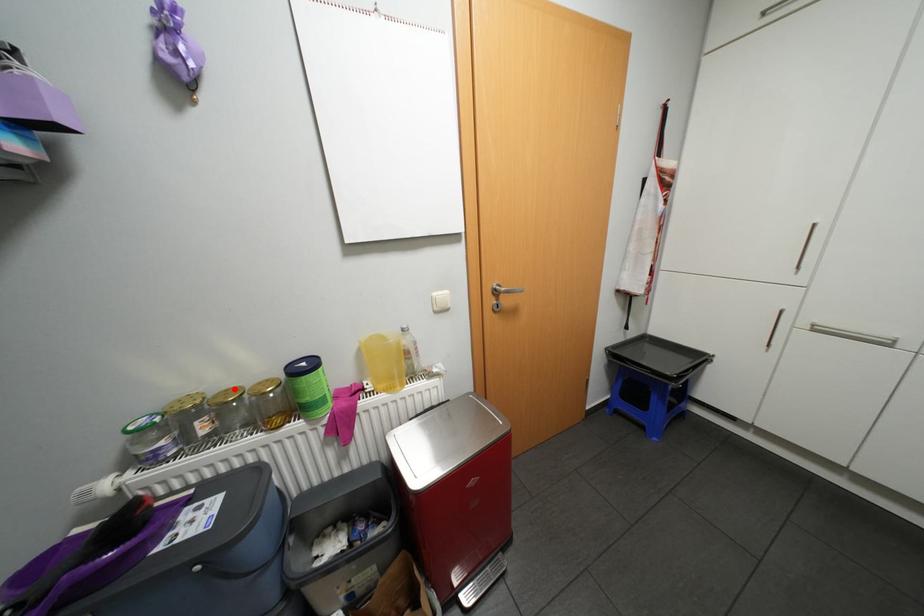
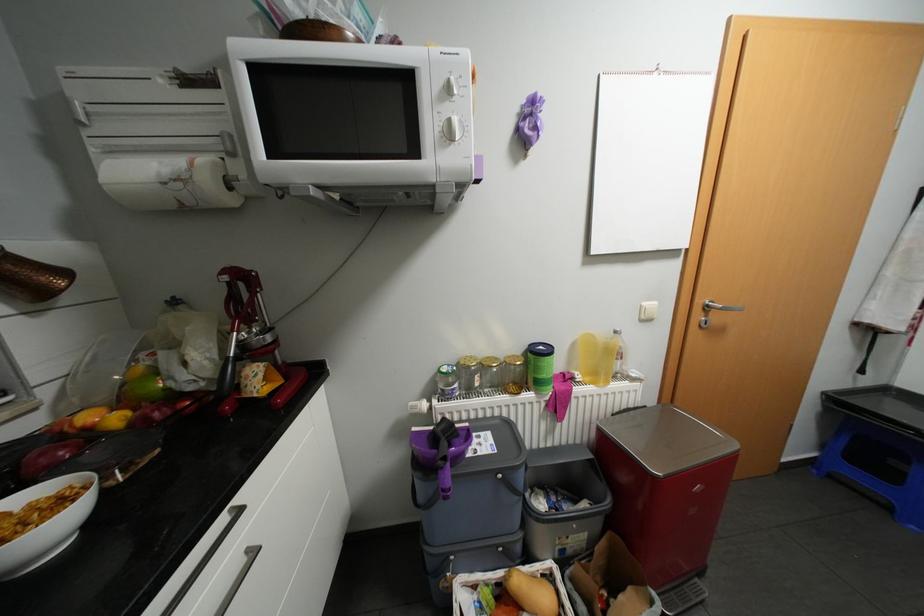
Locate, in the second image, the point that corresponds to the highlighted location in the first image.

(495, 357)